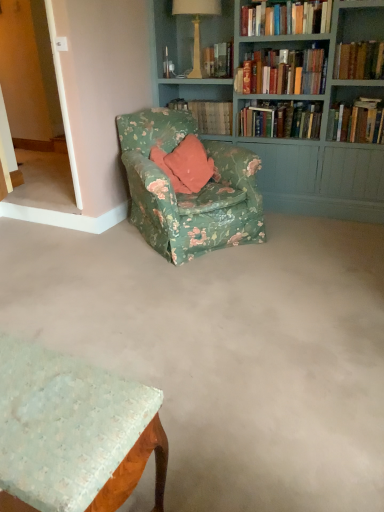
Locate an element on the screen. This screenshot has height=512, width=384. vacant space positioned to the left of floral fabric armchair at center is located at coordinates (69, 253).